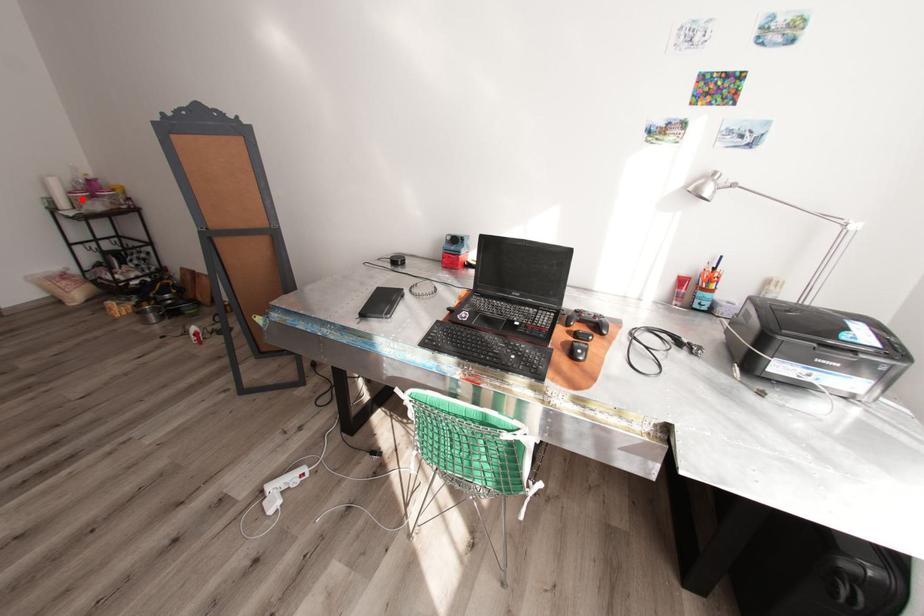
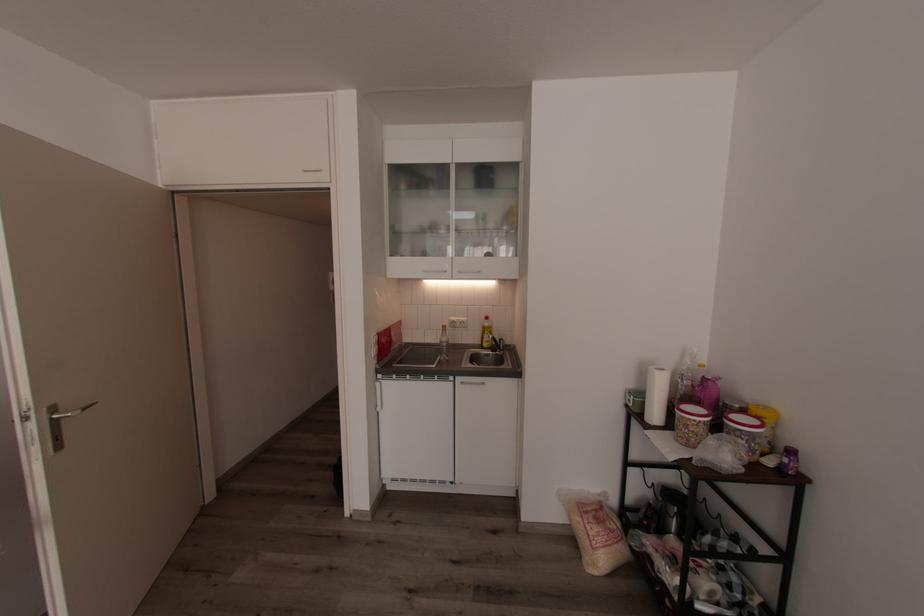
Where in the second image is the point corresponding to the highlighted location from the first image?

(690, 426)